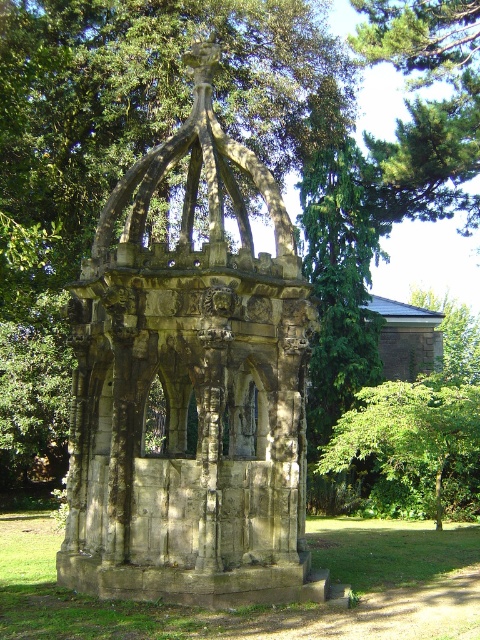
Does stone gazebo at center appear over green leafy tree at center?

Indeed, stone gazebo at center is positioned over green leafy tree at center.

Is point (154, 262) closer to viewer compared to point (432, 445)?

Yes, it is in front of point (432, 445).

This screenshot has width=480, height=640. I want to click on stone gazebo at center, so click(x=191, y=392).